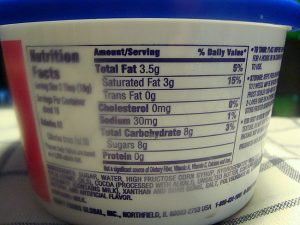
Locate an element on the screen. This screenshot has width=300, height=225. blanket is located at coordinates (291, 195).